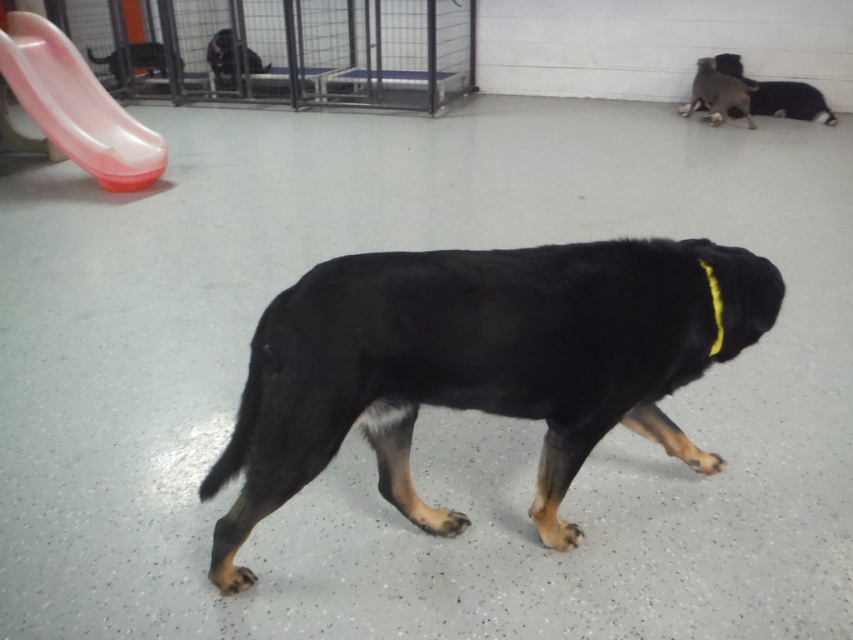
Question: Does black fur dog at upper right come in front of black matte dog at upper center?

Choices:
 (A) yes
 (B) no

Answer: (A)

Question: Which object appears closest to the camera in this image?

Choices:
 (A) black smooth dog at upper left
 (B) matte plastic slide at upper left
 (C) black matte dog at upper center
 (D) yellow fabric neckband at upper right

Answer: (D)

Question: Does metal wire cage at upper left appear under matte plastic slide at upper left?

Choices:
 (A) yes
 (B) no

Answer: (B)

Question: Which object is the farthest from the matte plastic slide at upper left?

Choices:
 (A) black matte dog at upper center
 (B) metal wire cage at upper left
 (C) black matte dog at upper right

Answer: (C)

Question: Among these objects, which one is nearest to the camera?

Choices:
 (A) black fur dog at center
 (B) matte plastic slide at upper left

Answer: (A)

Question: Is black fur dog at center to the left of metal wire cage at upper left from the viewer's perspective?

Choices:
 (A) yes
 (B) no

Answer: (B)